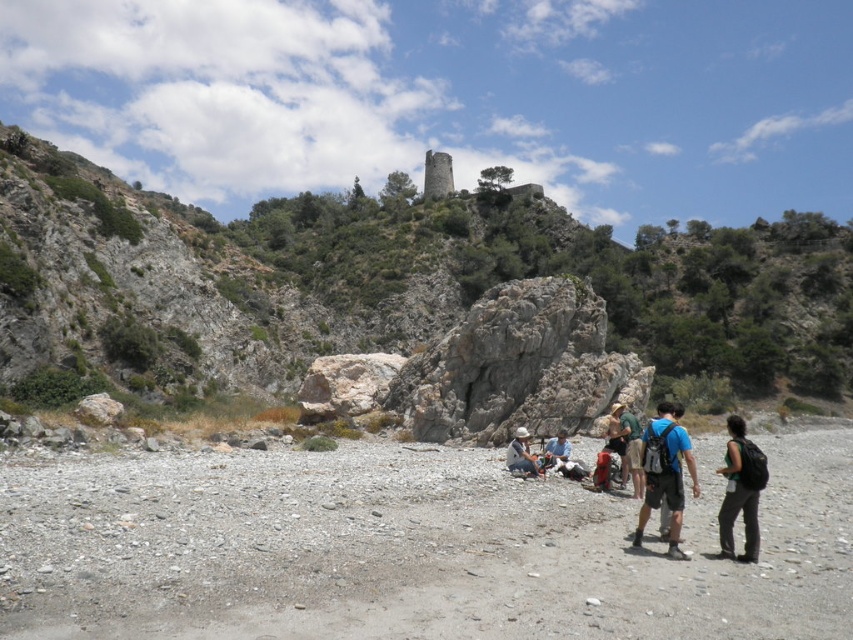
Question: Which object appears closest to the camera in this image?

Choices:
 (A) dark gray backpack at lower right
 (B) blue fabric backpack at lower right
 (C) green fabric backpack at center

Answer: (A)

Question: Which object appears closest to the camera in this image?

Choices:
 (A) matte white helmet at center
 (B) green fabric backpack at center
 (C) rocky terrain at upper center
 (D) dark gray backpack at lower right

Answer: (D)

Question: Observing the image, what is the correct spatial positioning of rocky terrain at upper center in reference to green fabric backpack at center?

Choices:
 (A) below
 (B) above

Answer: (B)

Question: Is rocky terrain at upper center thinner than dark gray backpack at lower right?

Choices:
 (A) yes
 (B) no

Answer: (B)

Question: Is the position of green fabric backpack at center more distant than that of matte white helmet at center?

Choices:
 (A) no
 (B) yes

Answer: (A)

Question: Among these objects, which one is farthest from the camera?

Choices:
 (A) white fabric bag at center
 (B) green fabric backpack at center
 (C) rocky terrain at upper center

Answer: (C)